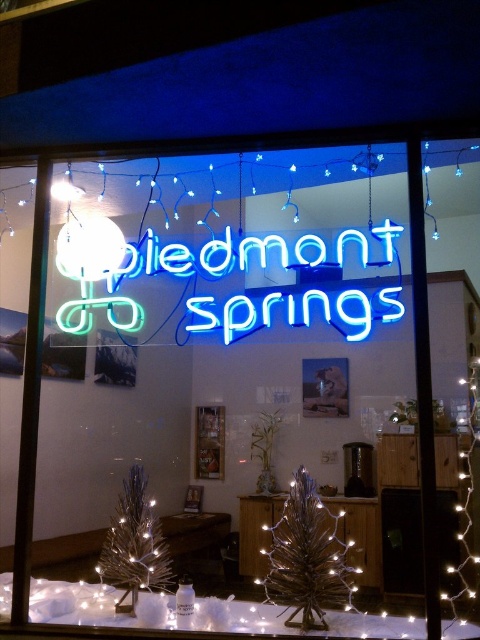
Question: Which object is closer to the camera taking this photo?

Choices:
 (A) iridescent metallic christmas tree at center
 (B) iridescent metallic christmas tree at lower left

Answer: (A)

Question: From the image, what is the correct spatial relationship of neon blue sign at center in relation to iridescent metallic christmas tree at center?

Choices:
 (A) below
 (B) above

Answer: (B)

Question: Which of the following is the closest to the observer?

Choices:
 (A) (269, 304)
 (B) (157, 557)
 (C) (320, 595)

Answer: (C)

Question: Is neon blue sign at center bigger than iridescent metallic christmas tree at center?

Choices:
 (A) no
 (B) yes

Answer: (B)

Question: Considering the real-world distances, which object is closest to the iridescent metallic christmas tree at center?

Choices:
 (A) neon blue sign at center
 (B) iridescent metallic christmas tree at lower left

Answer: (B)

Question: Does neon blue sign at center have a greater width compared to iridescent metallic christmas tree at lower left?

Choices:
 (A) no
 (B) yes

Answer: (B)